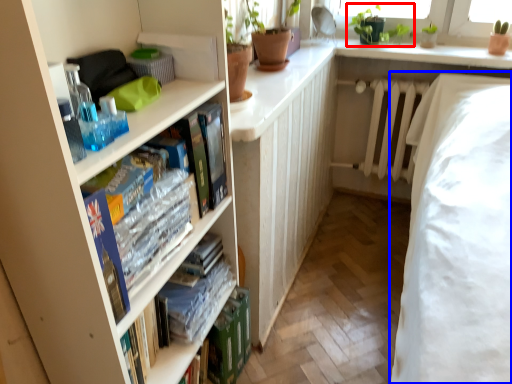
Question: Which object is closer to the camera taking this photo, plant (highlighted by a red box) or bed (highlighted by a blue box)?

Choices:
 (A) plant
 (B) bed

Answer: (B)